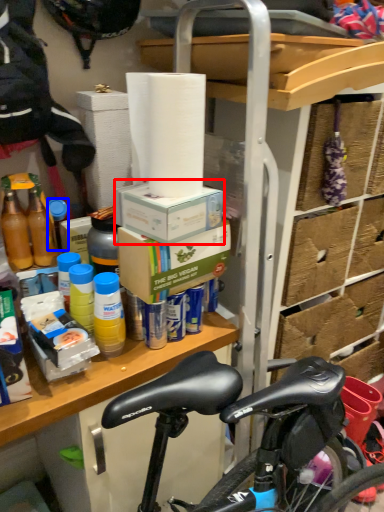
Question: Which point is further to the camera, box (highlighted by a red box) or bottle (highlighted by a blue box)?

Choices:
 (A) box
 (B) bottle

Answer: (B)